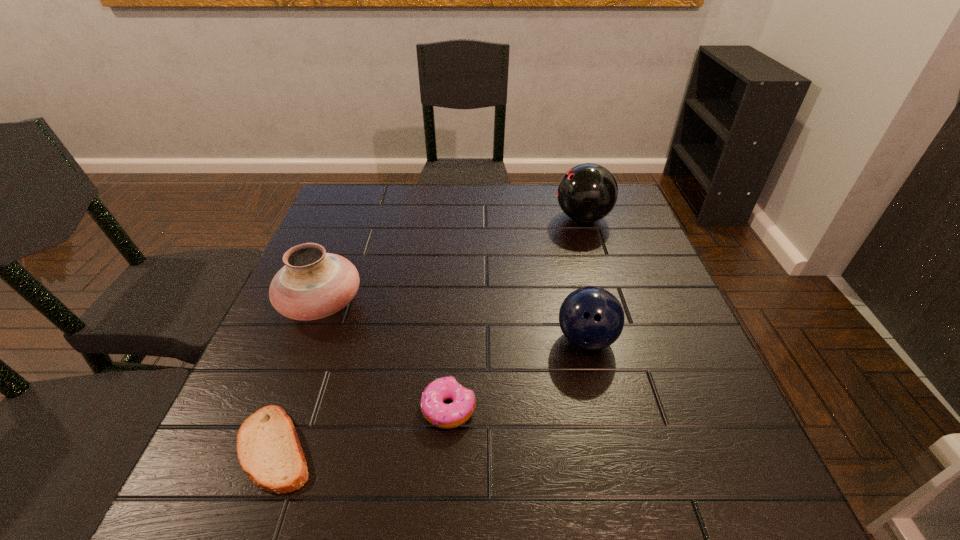
Image resolution: width=960 pixels, height=540 pixels. Find the location of `free spot between the pottery and the nearer bowling ball`. free spot between the pottery and the nearer bowling ball is located at coordinates (454, 322).

Identify the location of free space between the farther bowling ball and the second shortest object. (516, 313).

At what (x,y) coordinates should I click in order to perform the action: click on vacant space in between the taller bowling ball and the doughnut. Please return your answer as a coordinate pair (x, y). Looking at the image, I should click on (516, 313).

Find the location of a particular element. Image resolution: width=960 pixels, height=540 pixels. empty location between the pottery and the taller bowling ball is located at coordinates (452, 261).

You are a GUI agent. You are given a task and a screenshot of the screen. Output one action in this format:
    pyautogui.click(x=<x>, y=<y>)
    Task: Click on the unoccupied position between the taller bowling ball and the pottery
    This screenshot has height=540, width=960.
    Given the screenshot: What is the action you would take?
    pyautogui.click(x=452, y=261)

Identify the location of free space between the farthest object and the nearer bowling ball. This screenshot has height=540, width=960. (585, 279).

Select which object is the fourth closest to the doughnut. Please provide its 2D coordinates. Your answer should be formatted as a tuple, i.e. [(x, y)], where the tuple contains the x and y coordinates of a point satisfying the conditions above.

[(588, 192)]

Locate an element on the screen. Image resolution: width=960 pixels, height=540 pixels. the closest object to the third object from right to left is located at coordinates (268, 448).

Locate an element on the screen. This screenshot has width=960, height=540. vacant position in the image that satisfies the following two spatial constraints: 1. on the surface of the farther bowling ball near the finger holes; 2. on the front side of the pita bread is located at coordinates [656, 448].